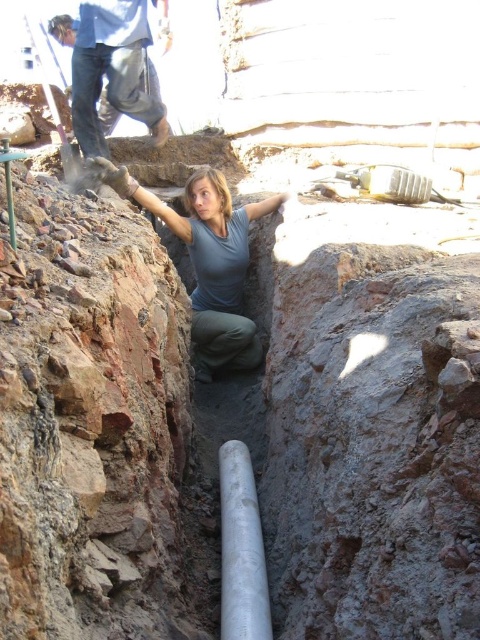
You are standing at the edge of the trench and want to reach the point marked at coordinates (98, 65). If your maximum reach distance is 24 meters, can you comfortably extend your arm to touch that point without moving your feet?

The point at coordinates (98, 65) is 24.32 meters away from the viewer. Since your maximum reach is only 24 meters, you cannot comfortably touch it without moving your feet.

You are a safety inspector at the construction site. You need to ensure that the matte gray shirt at center and the silver metallic pipe at center are visible to the crane operator who is lifting heavy materials. Which object is closer to the ground and why?

The matte gray shirt at center is closer to the ground because it is shorter than the silver metallic pipe at center.

You are a safety inspector at the construction site. You need to locate the worker wearing the matte gray shirt at center. Where exactly would you find this worker in the trench?

The worker wearing the matte gray shirt at center is located at point (x=207, y=260) in the trench.